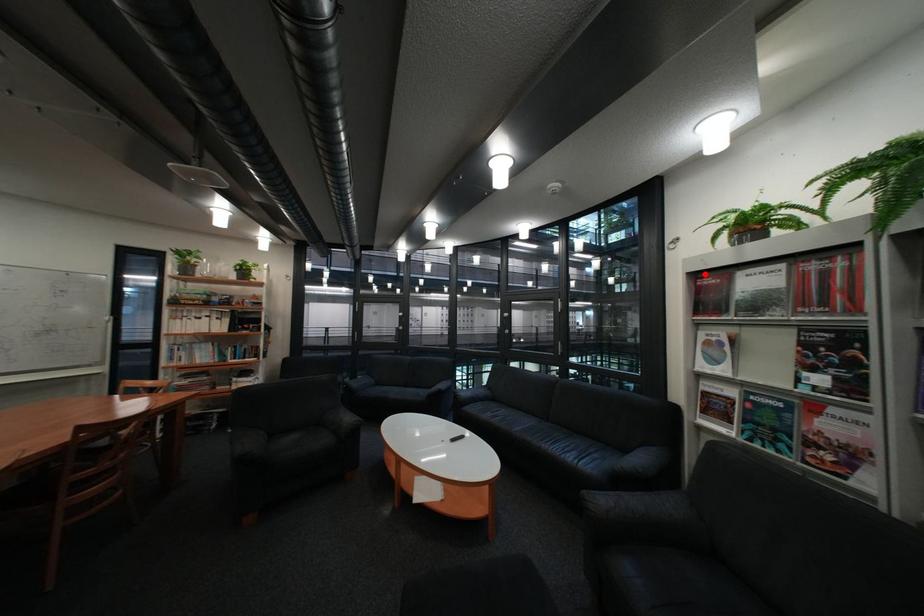
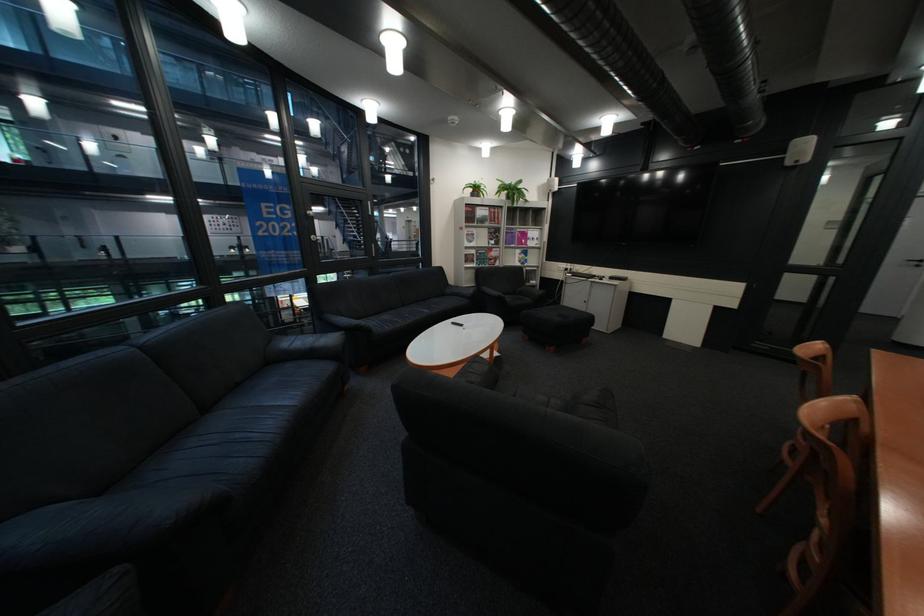
Question: I am providing you with two images of the same scene from different viewpoints. A red point is shown in image1. For the corresponding object point in image2, is it positioned nearer or farther from the camera?

Choices:
 (A) Nearer
 (B) Farther

Answer: (A)